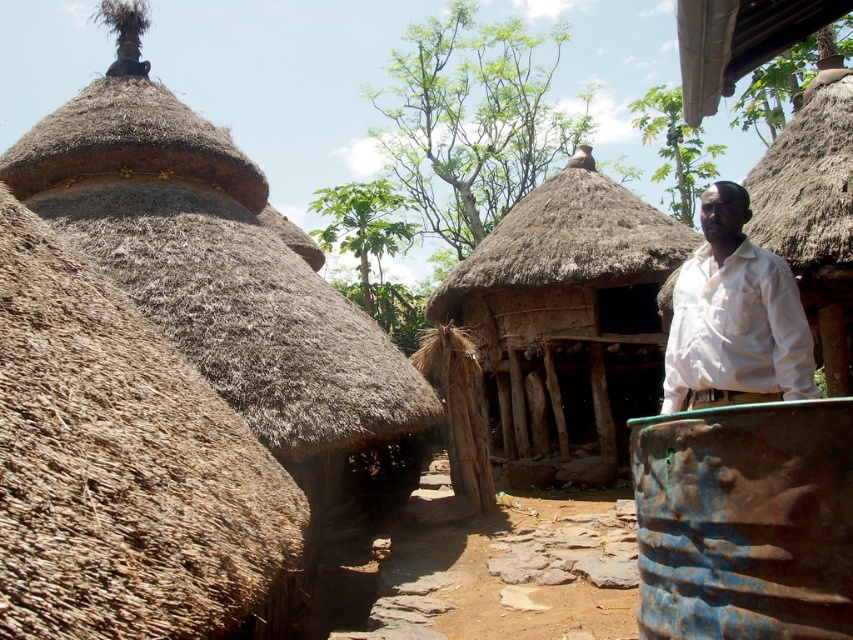
Question: Which point is closer to the camera?

Choices:
 (A) thatched wood hut at center
 (B) white cotton shirt at right
 (C) rusty metal barrel at right
 (D) brown thatch roof at center

Answer: (C)

Question: Which of the following is the closest to the observer?

Choices:
 (A) brown thatch roof at center
 (B) thatched wood hut at center

Answer: (A)

Question: Does rusty metal barrel at right appear over white cotton shirt at right?

Choices:
 (A) no
 (B) yes

Answer: (A)

Question: Does thatched wood hut at center appear under brown thatch roof at center?

Choices:
 (A) yes
 (B) no

Answer: (A)

Question: Is white cotton shirt at right to the left of brown thatch roof at center from the viewer's perspective?

Choices:
 (A) no
 (B) yes

Answer: (B)

Question: Among these points, which one is nearest to the camera?

Choices:
 (A) (759, 371)
 (B) (556, 205)
 (C) (506, 458)
 (D) (643, 561)

Answer: (D)